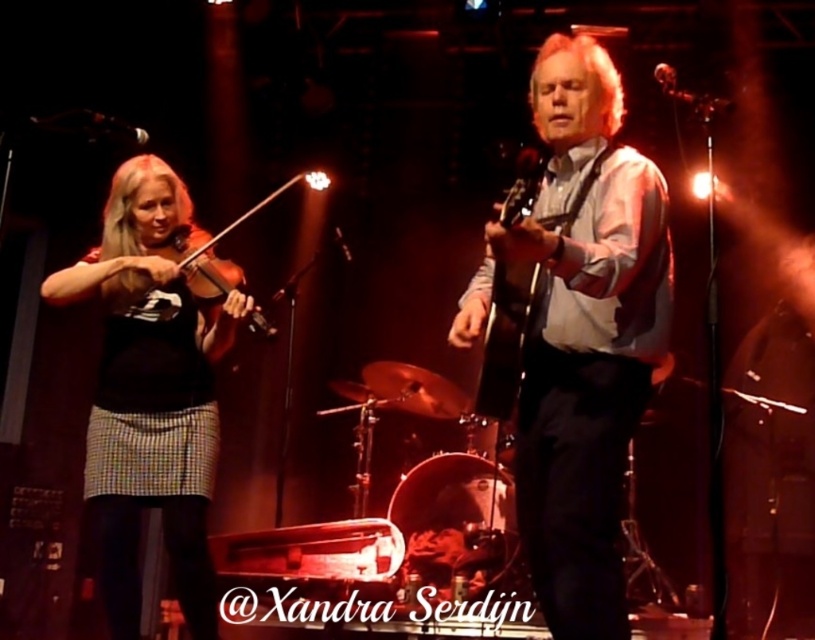
You are a photographer in the audience. You want to take a photo that clearly shows both the matte white shirt at center and the wooden violin at left. Given their sizes, which object should you focus on to ensure both are in frame and properly exposed?

The matte white shirt at center is larger than the wooden violin at left. To ensure both are in frame and properly exposed, focus on the matte white shirt at center since it is the larger object and will require more attention in the composition.

Based on the scene description, can you determine the exact coordinates of the black matte violin at left in the image?

The black matte violin at left is located at coordinates point (x=153, y=387).

Based on the scene description, which object is positioned higher in the image, the matte white shirt at center or the black matte violin at left?

The matte white shirt at center is positioned higher than the black matte violin at left in the image.